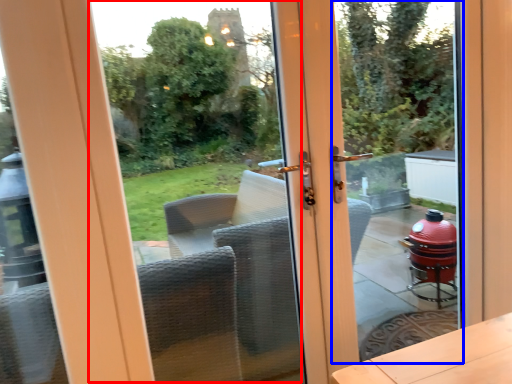
Question: Which object is further to the camera taking this photo, window screen (highlighted by a red box) or glass door (highlighted by a blue box)?

Choices:
 (A) window screen
 (B) glass door

Answer: (B)